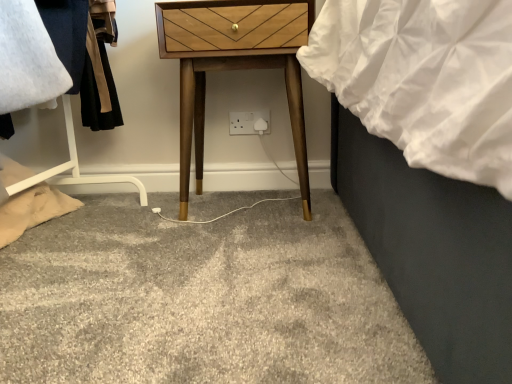
What is the approximate height of woodenmaterial/texturenightstand at center?

woodenmaterial/texturenightstand at center is 23.41 inches tall.

Identify the location of woodenmaterial/texturenightstand at center. (233, 65).

Measure the distance between point (286, 8) and camera.

Point (286, 8) and camera are 3.55 feet apart from each other.

The width and height of the screenshot is (512, 384). What do you see at coordinates (233, 65) in the screenshot? I see `woodenmaterial/texturenightstand at center` at bounding box center [233, 65].

This screenshot has height=384, width=512. I want to click on white plastic socket at center, so click(x=249, y=122).

This screenshot has height=384, width=512. What do you see at coordinates (249, 122) in the screenshot?
I see `white plastic socket at center` at bounding box center [249, 122].

What are the coordinates of `woodenmaterial/texturenightstand at center` in the screenshot? It's located at (233, 65).

Considering the positions of objects woodenmaterial/texturenightstand at center and white plastic socket at center in the image provided, who is more to the left, woodenmaterial/texturenightstand at center or white plastic socket at center?

woodenmaterial/texturenightstand at center is more to the left.

Which object is further away from the camera, woodenmaterial/texturenightstand at center or white plastic socket at center?

white plastic socket at center is further from the camera.

Does point (192, 94) come behind point (247, 126)?

No, (192, 94) is closer to viewer.

From the image's perspective, which is above, woodenmaterial/texturenightstand at center or white plastic socket at center?

From the image's view, woodenmaterial/texturenightstand at center is above.

Consider the image. From a real-world perspective, which object rests below the other?

From a 3D spatial view, white plastic socket at center is below.

Can you confirm if woodenmaterial/texturenightstand at center is wider than white plastic socket at center?

Yes, woodenmaterial/texturenightstand at center is wider than white plastic socket at center.

Which of these two, woodenmaterial/texturenightstand at center or white plastic socket at center, stands taller?

woodenmaterial/texturenightstand at center.

Is woodenmaterial/texturenightstand at center smaller than white plastic socket at center?

Actually, woodenmaterial/texturenightstand at center might be larger than white plastic socket at center.

Is woodenmaterial/texturenightstand at center not inside white plastic socket at center?

Yes, woodenmaterial/texturenightstand at center is not within white plastic socket at center.

Is woodenmaterial/texturenightstand at center beside white plastic socket at center?

There is a gap between woodenmaterial/texturenightstand at center and white plastic socket at center.

Is woodenmaterial/texturenightstand at center aimed at white plastic socket at center?

Yes, woodenmaterial/texturenightstand at center is facing white plastic socket at center.

Can you tell me how much woodenmaterial/texturenightstand at center and white plastic socket at center differ in facing direction?

There is a 0.772-degree angle between the facing directions of woodenmaterial/texturenightstand at center and white plastic socket at center.

Measure the distance from woodenmaterial/texturenightstand at center to white plastic socket at center.

woodenmaterial/texturenightstand at center and white plastic socket at center are 32.81 centimeters apart from each other.

Image resolution: width=512 pixels, height=384 pixels. Identify the location of nightstand that appears in front of the white plastic socket at center. (233, 65).

Which is more to the right, white plastic socket at center or woodenmaterial/texturenightstand at center?

white plastic socket at center.

Which is in front, white plastic socket at center or woodenmaterial/texturenightstand at center?

woodenmaterial/texturenightstand at center.

Between point (243, 123) and point (257, 33), which one is positioned in front?

The point (257, 33) is closer to the camera.

From the image's perspective, does white plastic socket at center appear lower than woodenmaterial/texturenightstand at center?

Indeed, from the image's perspective, white plastic socket at center is shown beneath woodenmaterial/texturenightstand at center.

From a real-world perspective, who is located lower, white plastic socket at center or woodenmaterial/texturenightstand at center?

white plastic socket at center is physically lower.

Considering the relative sizes of white plastic socket at center and woodenmaterial/texturenightstand at center in the image provided, is white plastic socket at center wider than woodenmaterial/texturenightstand at center?

Incorrect, the width of white plastic socket at center does not surpass that of woodenmaterial/texturenightstand at center.

Which of these two, white plastic socket at center or woodenmaterial/texturenightstand at center, stands shorter?

Standing shorter between the two is white plastic socket at center.

Considering the relative sizes of white plastic socket at center and woodenmaterial/texturenightstand at center in the image provided, is white plastic socket at center smaller than woodenmaterial/texturenightstand at center?

Yes, white plastic socket at center is smaller than woodenmaterial/texturenightstand at center.

Is white plastic socket at center situated inside woodenmaterial/texturenightstand at center or outside?

white plastic socket at center lies outside woodenmaterial/texturenightstand at center.

Is white plastic socket at center far away from woodenmaterial/texturenightstand at center?

white plastic socket at center is actually quite close to woodenmaterial/texturenightstand at center.

Could you tell me if white plastic socket at center is turned towards woodenmaterial/texturenightstand at center?

Yes, white plastic socket at center is oriented towards woodenmaterial/texturenightstand at center.

Locate an element on the screen. This screenshot has width=512, height=384. nightstand in front of the white plastic socket at center is located at coordinates (233, 65).

Locate an element on the screen. This screenshot has width=512, height=384. electric outlet on the right of woodenmaterial/texturenightstand at center is located at coordinates (249, 122).

I want to click on electric outlet that is behind the woodenmaterial/texturenightstand at center, so click(249, 122).